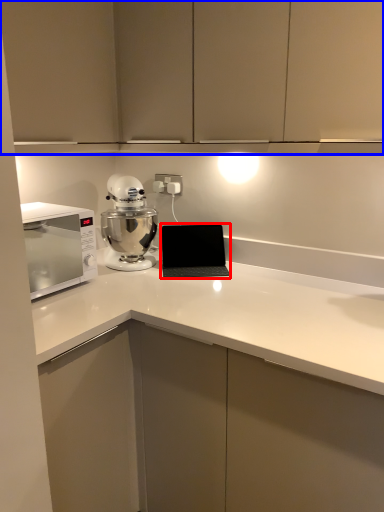
Question: Which object is further to the camera taking this photo, laptop (highlighted by a red box) or cabinetry (highlighted by a blue box)?

Choices:
 (A) laptop
 (B) cabinetry

Answer: (A)